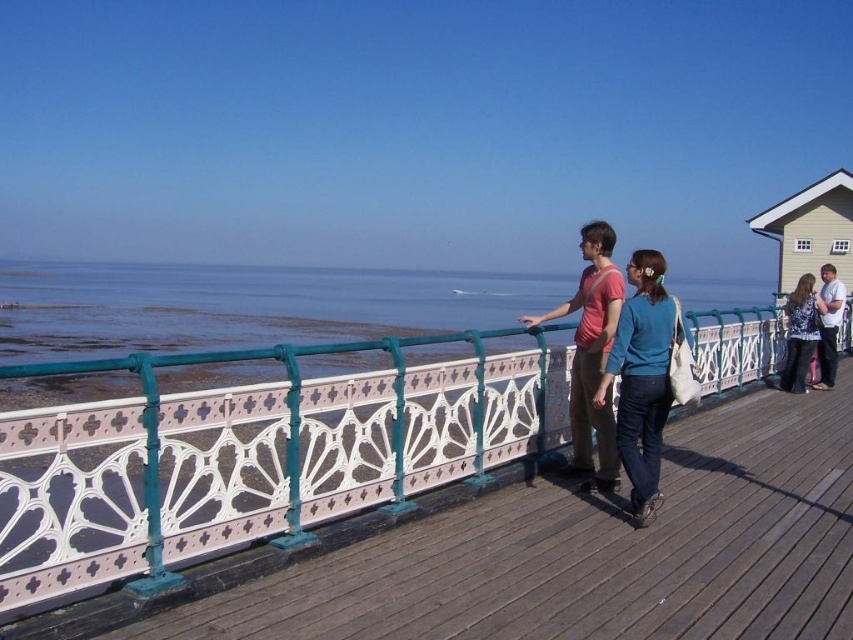
You are standing on the wooden walkway with the decorative metal railing painted in teal and white. You want to take a photo of the clear blue water at upper left. In which direction should you point your camera?

You should point your camera towards the upper left direction to capture the clear blue water at upper left, which is located at point coordinates of (244, 307).